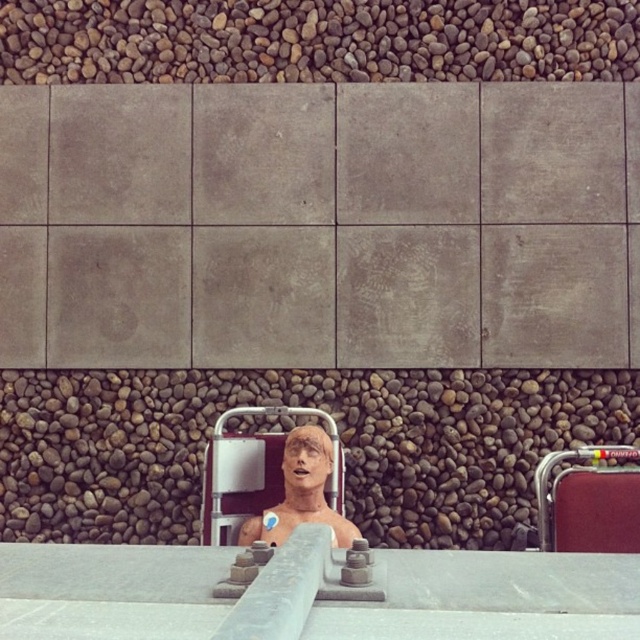
Question: From the image, what is the correct spatial relationship of brown rough stone at center in relation to smooth beige mannequin at center?

Choices:
 (A) left
 (B) right

Answer: (B)

Question: Where is brown rough stone at center located in relation to smooth beige mannequin at center in the image?

Choices:
 (A) below
 (B) above

Answer: (B)

Question: Which point is closer to the camera taking this photo?

Choices:
 (A) (68, 403)
 (B) (248, 518)

Answer: (B)

Question: Considering the relative positions of brown rough stone at center and smooth beige mannequin at center in the image provided, where is brown rough stone at center located with respect to smooth beige mannequin at center?

Choices:
 (A) above
 (B) below

Answer: (A)

Question: Which point is farther from the camera taking this photo?

Choices:
 (A) (68, 387)
 (B) (300, 456)

Answer: (A)